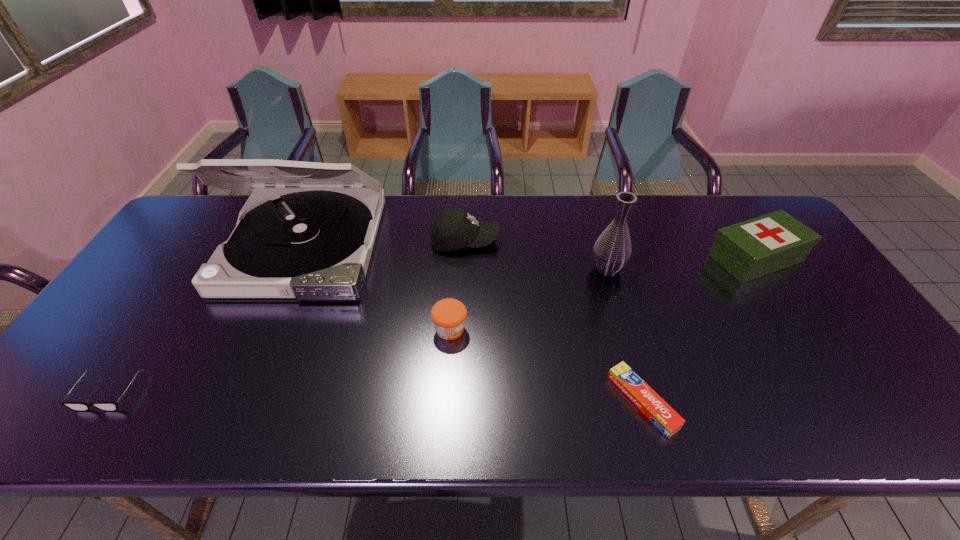
This screenshot has height=540, width=960. I want to click on CD player, so click(x=307, y=232).

Locate an element on the screen. The image size is (960, 540). the tallest object is located at coordinates (307, 232).

Where is `the second tallest object`? the second tallest object is located at coordinates (612, 250).

Where is `baseball cap`? The width and height of the screenshot is (960, 540). baseball cap is located at coordinates (452, 229).

At what (x,y) coordinates should I click in order to perform the action: click on the first-aid kit. Please return your answer as a coordinate pair (x, y). This screenshot has height=540, width=960. Looking at the image, I should click on (754, 248).

This screenshot has width=960, height=540. I want to click on the fifth farthest object, so click(x=448, y=315).

Where is `jam`? The width and height of the screenshot is (960, 540). jam is located at coordinates (448, 315).

Identify the location of the leftmost object. (75, 406).

Where is `toothpaste`? The width and height of the screenshot is (960, 540). toothpaste is located at coordinates (660, 413).

What are the coordinates of `blank area located on the control panel of the CD player` in the screenshot? It's located at (231, 415).